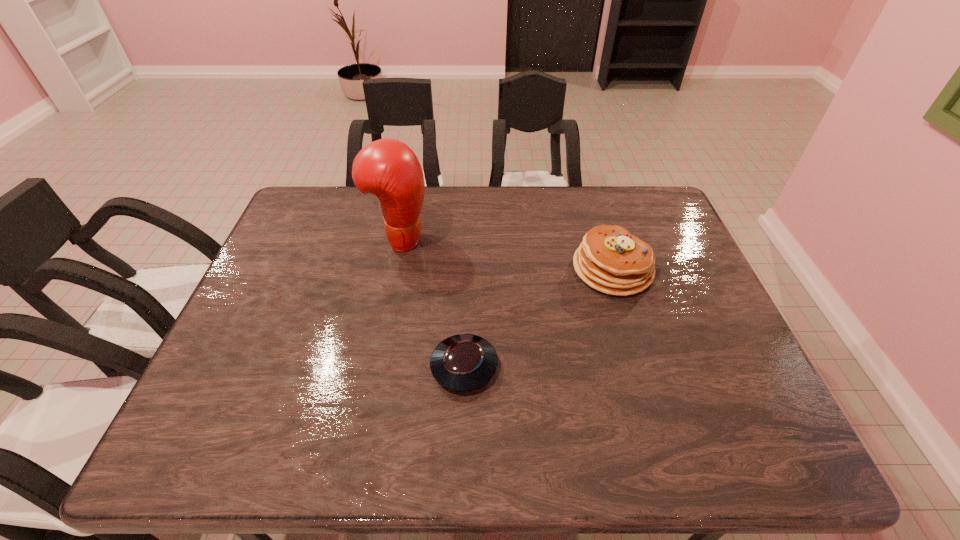
This screenshot has width=960, height=540. What are the coordinates of `boxing glove` in the screenshot? It's located at coord(388,168).

At what (x,y) coordinates should I click in order to perform the action: click on the tallest object. Please return your answer as a coordinate pair (x, y). The width and height of the screenshot is (960, 540). Looking at the image, I should click on (388, 168).

Locate an element on the screen. This screenshot has height=540, width=960. the rightmost object is located at coordinates (611, 260).

This screenshot has width=960, height=540. What are the coordinates of `the second shortest object` in the screenshot? It's located at (611, 260).

The image size is (960, 540). Identify the location of the shortest object. (464, 362).

The height and width of the screenshot is (540, 960). Find the location of `the second object from right to left`. the second object from right to left is located at coordinates (464, 362).

Locate an element on the screen. The height and width of the screenshot is (540, 960). blank space located on the striking surface of the leftmost object is located at coordinates (540, 239).

Where is `vacant space positioned on the left of the rightmost object`? The height and width of the screenshot is (540, 960). vacant space positioned on the left of the rightmost object is located at coordinates (530, 269).

What are the coordinates of `vacant space located on the right of the shortest object` in the screenshot? It's located at (532, 367).

The image size is (960, 540). I want to click on object that is at the far edge, so click(388, 168).